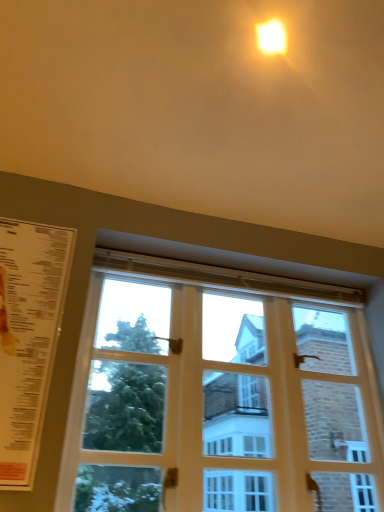
Question: Considering the relative positions of white wooden window at center and matte yellow light at upper center in the image provided, is white wooden window at center to the right of matte yellow light at upper center from the viewer's perspective?

Choices:
 (A) yes
 (B) no

Answer: (B)

Question: Would you say white wooden window at center is a long distance from matte yellow light at upper center?

Choices:
 (A) yes
 (B) no

Answer: (A)

Question: Would you say white wooden window at center contains matte yellow light at upper center?

Choices:
 (A) no
 (B) yes

Answer: (A)

Question: Is white wooden window at center facing towards matte yellow light at upper center?

Choices:
 (A) yes
 (B) no

Answer: (B)

Question: From the image's perspective, is white wooden window at center over matte yellow light at upper center?

Choices:
 (A) yes
 (B) no

Answer: (B)

Question: From a real-world perspective, is white wooden window at center located higher than matte yellow light at upper center?

Choices:
 (A) yes
 (B) no

Answer: (B)

Question: Can you confirm if white paper menu at left is wider than matte yellow light at upper center?

Choices:
 (A) yes
 (B) no

Answer: (B)

Question: Can you confirm if white paper menu at left is smaller than matte yellow light at upper center?

Choices:
 (A) yes
 (B) no

Answer: (B)

Question: Is white paper menu at left closer to camera compared to matte yellow light at upper center?

Choices:
 (A) no
 (B) yes

Answer: (B)

Question: Does white paper menu at left turn towards matte yellow light at upper center?

Choices:
 (A) no
 (B) yes

Answer: (A)

Question: From the image's perspective, does white paper menu at left appear lower than matte yellow light at upper center?

Choices:
 (A) yes
 (B) no

Answer: (A)

Question: From a real-world perspective, is white paper menu at left beneath matte yellow light at upper center?

Choices:
 (A) yes
 (B) no

Answer: (A)

Question: From the image's perspective, would you say matte yellow light at upper center is shown under white wooden window at center?

Choices:
 (A) yes
 (B) no

Answer: (B)